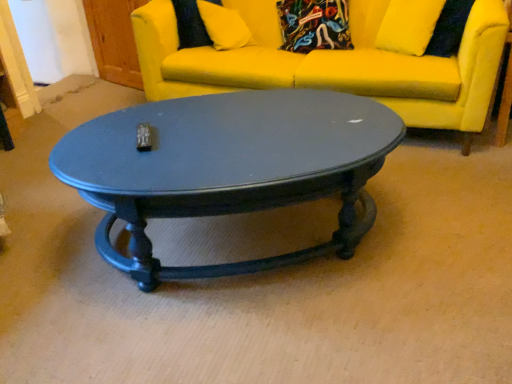
Question: Is yellow fabric pillow at upper center at the right side of matte black coffee table at center?

Choices:
 (A) yes
 (B) no

Answer: (B)

Question: Considering the relative sizes of yellow fabric pillow at upper center and matte black coffee table at center in the image provided, is yellow fabric pillow at upper center wider than matte black coffee table at center?

Choices:
 (A) no
 (B) yes

Answer: (A)

Question: Considering the relative sizes of yellow fabric pillow at upper center and matte black coffee table at center in the image provided, is yellow fabric pillow at upper center thinner than matte black coffee table at center?

Choices:
 (A) no
 (B) yes

Answer: (B)

Question: Are yellow fabric pillow at upper center and matte black coffee table at center beside each other?

Choices:
 (A) yes
 (B) no

Answer: (B)

Question: Can you confirm if yellow fabric pillow at upper center is bigger than matte black coffee table at center?

Choices:
 (A) yes
 (B) no

Answer: (B)

Question: Is yellow fabric pillow at upper center closer to camera compared to matte black coffee table at center?

Choices:
 (A) no
 (B) yes

Answer: (A)

Question: From a real-world perspective, is yellow fabric couch at upper center over yellow fabric pillow at upper center?

Choices:
 (A) yes
 (B) no

Answer: (B)

Question: From a real-world perspective, is yellow fabric couch at upper center positioned under yellow fabric pillow at upper center based on gravity?

Choices:
 (A) no
 (B) yes

Answer: (B)

Question: Is yellow fabric couch at upper center wider than yellow fabric pillow at upper center?

Choices:
 (A) yes
 (B) no

Answer: (A)

Question: Is yellow fabric couch at upper center beside yellow fabric pillow at upper center?

Choices:
 (A) no
 (B) yes

Answer: (A)

Question: Is yellow fabric couch at upper center turned away from yellow fabric pillow at upper center?

Choices:
 (A) yes
 (B) no

Answer: (A)

Question: From the image's perspective, is yellow fabric couch at upper center on yellow fabric pillow at upper center?

Choices:
 (A) no
 (B) yes

Answer: (A)

Question: Is matte black coffee table at center thinner than yellow fabric pillow at upper center?

Choices:
 (A) no
 (B) yes

Answer: (A)